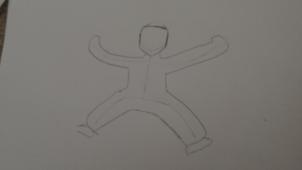
In order to click on beige surface in this screenshot , I will do `click(2, 26)`.